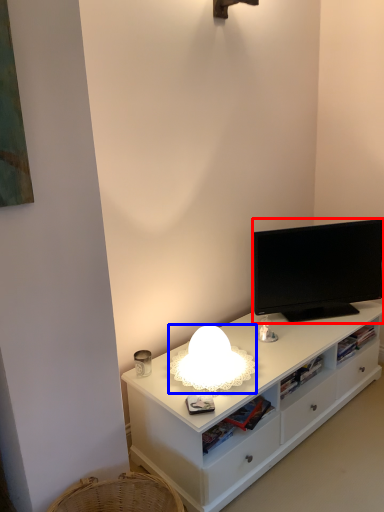
Question: Which of the following is the farthest to the observer, television (highlighted by a red box) or lamp (highlighted by a blue box)?

Choices:
 (A) television
 (B) lamp

Answer: (A)